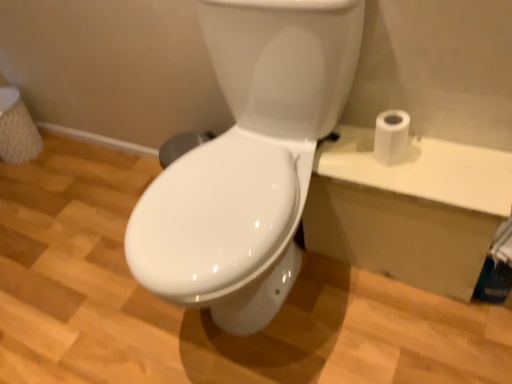
The height and width of the screenshot is (384, 512). What do you see at coordinates (248, 160) in the screenshot? I see `white glossy toilet at center` at bounding box center [248, 160].

The height and width of the screenshot is (384, 512). In order to click on white glossy toilet at center in this screenshot , I will do `click(248, 160)`.

Where is `white matte toilet paper at right`? The height and width of the screenshot is (384, 512). white matte toilet paper at right is located at coordinates (391, 136).

The width and height of the screenshot is (512, 384). What do you see at coordinates (391, 136) in the screenshot?
I see `white matte toilet paper at right` at bounding box center [391, 136].

Identify the location of white glossy toilet at center. The width and height of the screenshot is (512, 384). (248, 160).

Is white glossy toilet at center to the right of white matte toilet paper at right from the viewer's perspective?

Incorrect, white glossy toilet at center is not on the right side of white matte toilet paper at right.

Who is more distant, white glossy toilet at center or white matte toilet paper at right?

Positioned behind is white matte toilet paper at right.

Considering the positions of point (316, 7) and point (393, 110), is point (316, 7) closer or farther from the camera than point (393, 110)?

Point (316, 7) appears to be closer to the viewer than point (393, 110).

From the image's perspective, is white glossy toilet at center above white matte toilet paper at right?

No.

From a real-world perspective, is white glossy toilet at center located higher than white matte toilet paper at right?

No, from a real-world perspective, white glossy toilet at center is not on top of white matte toilet paper at right.

Considering the sizes of objects white glossy toilet at center and white matte toilet paper at right in the image provided, who is wider, white glossy toilet at center or white matte toilet paper at right?

With larger width is white glossy toilet at center.

Considering the relative sizes of white glossy toilet at center and white matte toilet paper at right in the image provided, is white glossy toilet at center shorter than white matte toilet paper at right?

No, white glossy toilet at center is not shorter than white matte toilet paper at right.

Can you confirm if white glossy toilet at center is smaller than white matte toilet paper at right?

No.

Is white glossy toilet at center completely or partially outside of white matte toilet paper at right?

Indeed, white glossy toilet at center is completely outside white matte toilet paper at right.

Is white glossy toilet at center beside white matte toilet paper at right?

No, white glossy toilet at center is not beside white matte toilet paper at right.

Is white glossy toilet at center positioned with its back to white matte toilet paper at right?

That's not correct — white glossy toilet at center is not looking away from white matte toilet paper at right.

How different are the orientations of white glossy toilet at center and white matte toilet paper at right in degrees?

The facing directions of white glossy toilet at center and white matte toilet paper at right are 2.42 degrees apart.

Measure the distance between white glossy toilet at center and white matte toilet paper at right.

Result: white glossy toilet at center is 12.69 inches from white matte toilet paper at right.

Where is `toilet directly beneath the white matte toilet paper at right (from a real-world perspective)`? toilet directly beneath the white matte toilet paper at right (from a real-world perspective) is located at coordinates point(248,160).

Based on their positions, is white matte toilet paper at right located to the left or right of white glossy toilet at center?

In the image, white matte toilet paper at right appears on the right side of white glossy toilet at center.

Consider the image. Considering the positions of objects white matte toilet paper at right and white glossy toilet at center in the image provided, who is in front, white matte toilet paper at right or white glossy toilet at center?

white glossy toilet at center.

Between point (387, 159) and point (258, 37), which one is positioned in front?

Point (258, 37)

From the image's perspective, is white matte toilet paper at right located above or below white glossy toilet at center?

Clearly, from the image's perspective, white matte toilet paper at right is above white glossy toilet at center.

From a real-world perspective, is white matte toilet paper at right on top of white glossy toilet at center?

Yes, from a real-world perspective, white matte toilet paper at right is above white glossy toilet at center.

Is white matte toilet paper at right wider than white glossy toilet at center?

Incorrect, the width of white matte toilet paper at right does not surpass that of white glossy toilet at center.

Who is shorter, white matte toilet paper at right or white glossy toilet at center?

white matte toilet paper at right.

Is white matte toilet paper at right smaller than white glossy toilet at center?

Yes, white matte toilet paper at right is smaller than white glossy toilet at center.

Is white matte toilet paper at right not within white glossy toilet at center?

Absolutely, white matte toilet paper at right is external to white glossy toilet at center.

Is white matte toilet paper at right not close to white glossy toilet at center?

Actually, white matte toilet paper at right and white glossy toilet at center are a little close together.

Is white matte toilet paper at right oriented away from white glossy toilet at center?

No, white matte toilet paper at right is not facing away from white glossy toilet at center.

How different are the orientations of white matte toilet paper at right and white glossy toilet at center in degrees?

2.42 degrees.

Where is `toilet that is under the white matte toilet paper at right (from a real-world perspective)`? Image resolution: width=512 pixels, height=384 pixels. toilet that is under the white matte toilet paper at right (from a real-world perspective) is located at coordinates click(x=248, y=160).

Find the location of a particular element. This screenshot has height=384, width=512. toilet that appears below the white matte toilet paper at right (from the image's perspective) is located at coordinates (248, 160).

What are the coordinates of `toilet paper that appears behind the white glossy toilet at center` in the screenshot? It's located at (391, 136).